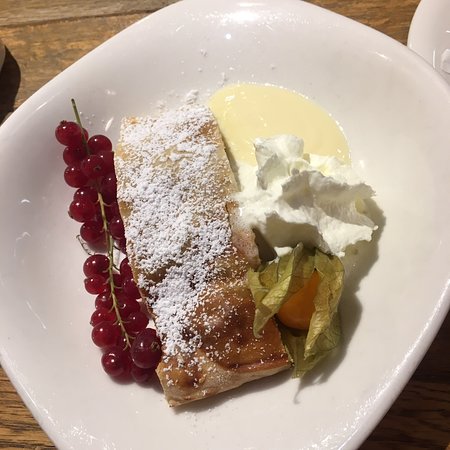
At what (x,y) coordinates should I click in order to perform the action: click on plate. Please return your answer as a coordinate pair (x, y). Looking at the image, I should click on (53, 361).